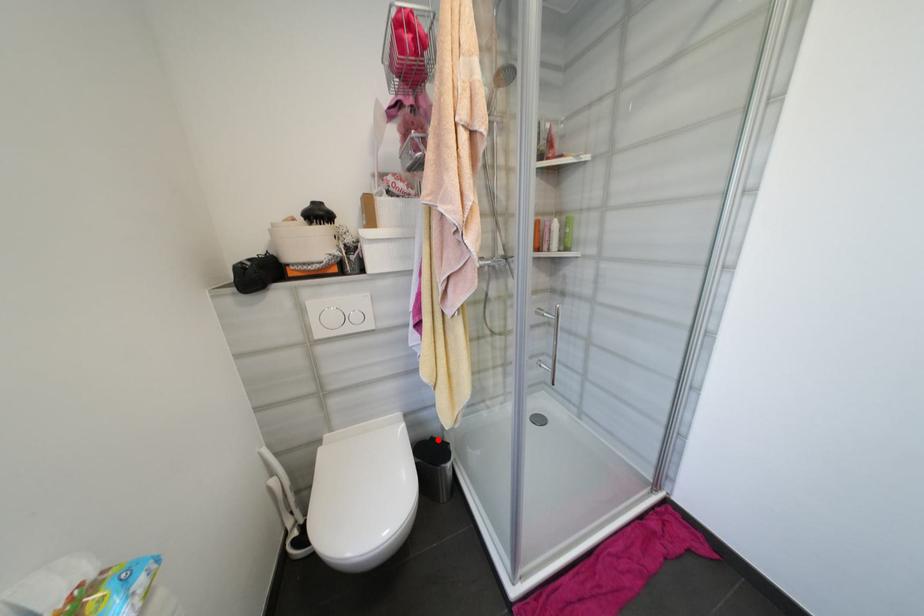
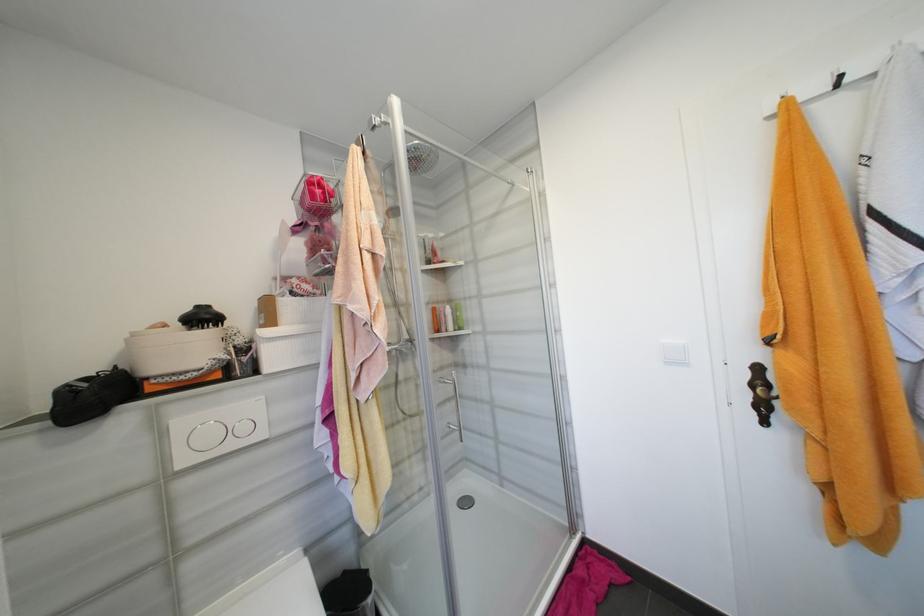
Question: I am providing you with two images of the same scene from different viewpoints. Image1 has a red point marked. In image2, the corresponding 3D location appears at what relative position? Reply with the corresponding letter.

Choices:
 (A) Closer
 (B) Farther

Answer: (A)